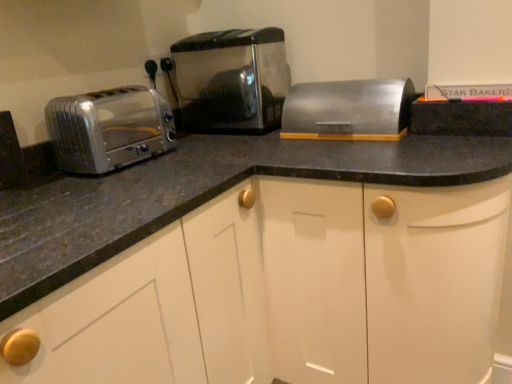
Question: Considering the relative positions of satin silver toaster at left, arranged as the 1th toaster when viewed from the left, and satin silver breadbox at center in the image provided, is satin silver toaster at left, arranged as the 1th toaster when viewed from the left, to the right of satin silver breadbox at center from the viewer's perspective?

Choices:
 (A) no
 (B) yes

Answer: (A)

Question: From a real-world perspective, is satin silver toaster at left, positioned as the second toaster in right-to-left order, physically above satin silver breadbox at center?

Choices:
 (A) no
 (B) yes

Answer: (B)

Question: Considering the relative sizes of satin silver toaster at left, positioned as the second toaster in right-to-left order, and satin silver breadbox at center in the image provided, is satin silver toaster at left, positioned as the second toaster in right-to-left order, taller than satin silver breadbox at center?

Choices:
 (A) yes
 (B) no

Answer: (A)

Question: Is satin silver breadbox at center at the back of satin silver toaster at left, arranged as the 1th toaster when viewed from the left?

Choices:
 (A) no
 (B) yes

Answer: (A)

Question: Considering the relative positions of satin silver toaster at left, positioned as the second toaster in right-to-left order, and satin silver breadbox at center in the image provided, is satin silver toaster at left, positioned as the second toaster in right-to-left order, in front of satin silver breadbox at center?

Choices:
 (A) yes
 (B) no

Answer: (A)

Question: In the image, is satin silver toaster at left, positioned as the second toaster in right-to-left order, positioned in front of or behind satin metallic toaster at center, the second toaster viewed from the left?

Choices:
 (A) front
 (B) behind

Answer: (A)

Question: Based on their positions, is satin silver toaster at left, positioned as the second toaster in right-to-left order, located to the left or right of satin metallic toaster at center, acting as the 1th toaster starting from the right?

Choices:
 (A) left
 (B) right

Answer: (A)

Question: Would you say satin silver toaster at left, positioned as the second toaster in right-to-left order, is inside or outside satin metallic toaster at center, the second toaster viewed from the left?

Choices:
 (A) outside
 (B) inside

Answer: (A)

Question: Is satin silver toaster at left, positioned as the second toaster in right-to-left order, bigger or smaller than satin metallic toaster at center, the second toaster viewed from the left?

Choices:
 (A) small
 (B) big

Answer: (A)

Question: Is satin metallic toaster at center, the second toaster viewed from the left, in front of or behind satin silver toaster at left, positioned as the second toaster in right-to-left order, in the image?

Choices:
 (A) behind
 (B) front

Answer: (A)

Question: Is satin metallic toaster at center, the second toaster viewed from the left, to the left or to the right of satin silver toaster at left, arranged as the 1th toaster when viewed from the left, in the image?

Choices:
 (A) left
 (B) right

Answer: (B)

Question: From the image's perspective, is satin metallic toaster at center, acting as the 1th toaster starting from the right, located above or below satin silver toaster at left, arranged as the 1th toaster when viewed from the left?

Choices:
 (A) above
 (B) below

Answer: (A)

Question: Is satin metallic toaster at center, acting as the 1th toaster starting from the right, wider or thinner than satin silver toaster at left, positioned as the second toaster in right-to-left order?

Choices:
 (A) wide
 (B) thin

Answer: (A)

Question: Considering the positions of satin silver breadbox at center and satin silver toaster at left, positioned as the second toaster in right-to-left order, in the image, is satin silver breadbox at center wider or thinner than satin silver toaster at left, positioned as the second toaster in right-to-left order,?

Choices:
 (A) thin
 (B) wide

Answer: (A)

Question: Relative to satin silver toaster at left, arranged as the 1th toaster when viewed from the left, is satin silver breadbox at center in front or behind?

Choices:
 (A) behind
 (B) front

Answer: (A)